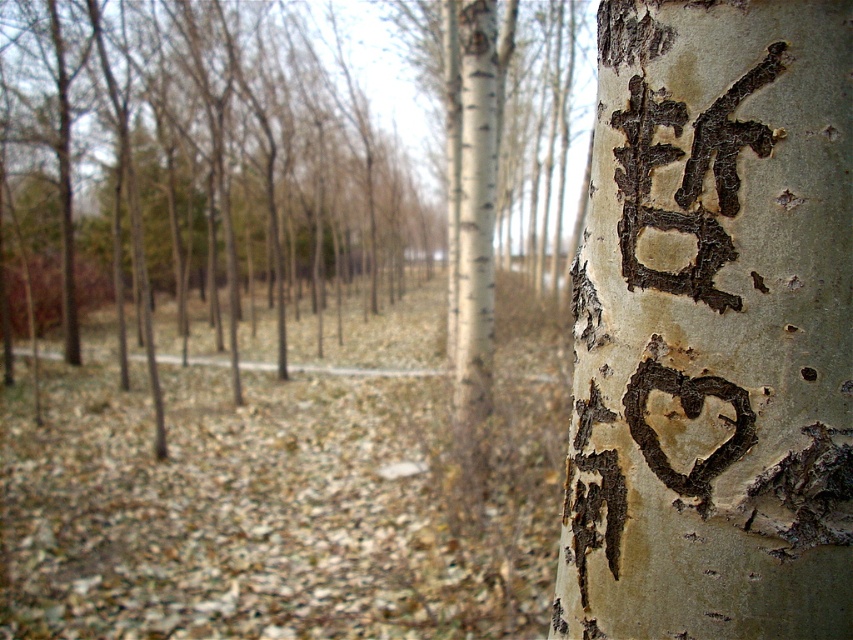
Question: Is smooth white bark at center further to camera compared to black bark writing at upper right?

Choices:
 (A) no
 (B) yes

Answer: (A)

Question: Which object appears closest to the camera in this image?

Choices:
 (A) smooth white bark at center
 (B) black bark writing at upper right

Answer: (A)

Question: Can you confirm if smooth white bark at center is thinner than black bark writing at upper right?

Choices:
 (A) yes
 (B) no

Answer: (B)

Question: Does smooth white bark at center have a smaller size compared to black bark writing at upper right?

Choices:
 (A) no
 (B) yes

Answer: (A)

Question: Which of the following is the farthest from the observer?

Choices:
 (A) (711, 250)
 (B) (595, 508)

Answer: (B)